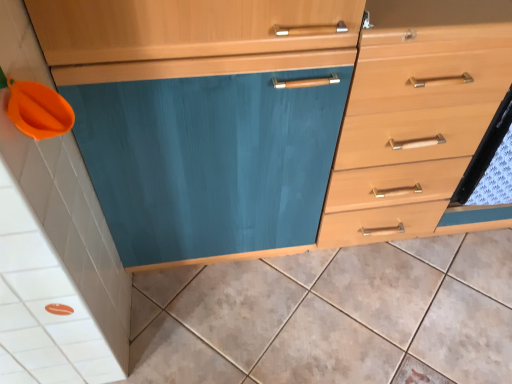
Question: Does light wood drawer at center right have a greater width compared to matte ceramic tile at lower left?

Choices:
 (A) yes
 (B) no

Answer: (B)

Question: Is light wood drawer at center right facing away from matte ceramic tile at lower left?

Choices:
 (A) yes
 (B) no

Answer: (B)

Question: Is light wood drawer at center right at the right side of matte ceramic tile at lower left?

Choices:
 (A) no
 (B) yes

Answer: (B)

Question: Considering the relative sizes of light wood drawer at center right and matte ceramic tile at lower left in the image provided, is light wood drawer at center right taller than matte ceramic tile at lower left?

Choices:
 (A) no
 (B) yes

Answer: (B)

Question: Could you tell me if light wood drawer at center right is facing matte ceramic tile at lower left?

Choices:
 (A) yes
 (B) no

Answer: (A)

Question: Is light wood drawer at center right closer to the viewer compared to matte ceramic tile at lower left?

Choices:
 (A) yes
 (B) no

Answer: (A)

Question: Does matte ceramic tile at lower left have a larger size compared to light wood drawer at center right?

Choices:
 (A) no
 (B) yes

Answer: (A)

Question: Is matte ceramic tile at lower left smaller than light wood drawer at center right?

Choices:
 (A) yes
 (B) no

Answer: (A)

Question: Is matte ceramic tile at lower left far from light wood drawer at center right?

Choices:
 (A) no
 (B) yes

Answer: (A)

Question: From the image's perspective, is matte ceramic tile at lower left below light wood drawer at center right?

Choices:
 (A) yes
 (B) no

Answer: (A)

Question: Can you confirm if matte ceramic tile at lower left is shorter than light wood drawer at center right?

Choices:
 (A) yes
 (B) no

Answer: (A)

Question: Is matte ceramic tile at lower left at the right side of light wood drawer at center right?

Choices:
 (A) no
 (B) yes

Answer: (A)

Question: In terms of height, does light wood drawer at center right look taller or shorter compared to matte ceramic tile at lower left?

Choices:
 (A) tall
 (B) short

Answer: (A)